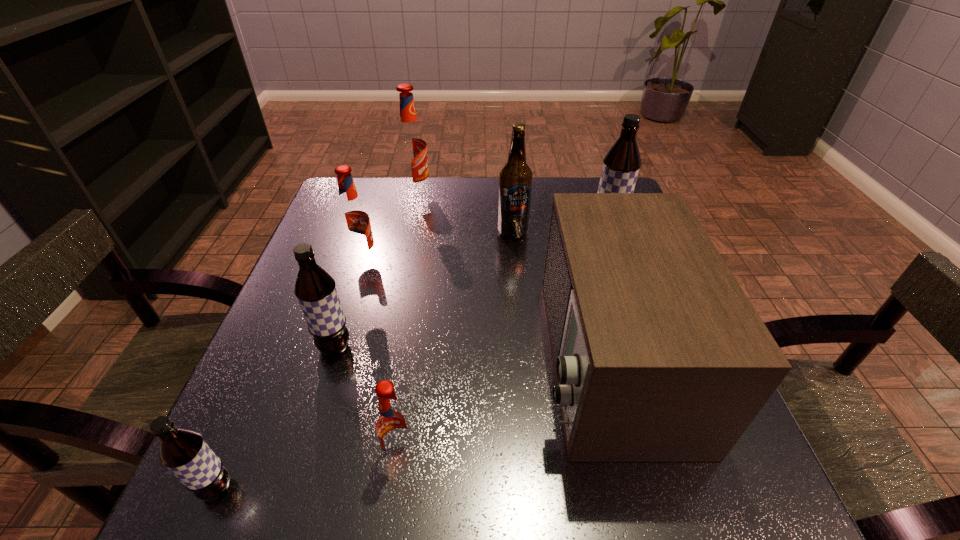
You are a GUI agent. You are given a task and a screenshot of the screen. Output one action in this format:
    pyautogui.click(x=<x>, y=<y>)
    Task: Click on the farthest red root beer
    Image resolution: width=960 pixels, height=540 pixels.
    Given the screenshot: What is the action you would take?
    pyautogui.click(x=411, y=148)

The width and height of the screenshot is (960, 540). Identify the location of the farthest object. (411, 148).

The width and height of the screenshot is (960, 540). Identify the location of the fifth nearest root beer. (621, 165).

This screenshot has width=960, height=540. Identify the location of the rightmost brown root beer. (621, 165).

You are a GUI agent. You are given a task and a screenshot of the screen. Output one action in this format:
    pyautogui.click(x=<x>, y=<y>)
    Task: Click on the beer bottle
    Image resolution: width=960 pixels, height=540 pixels.
    Given the screenshot: What is the action you would take?
    pyautogui.click(x=515, y=180)

At what (x,y) coordinates should I click in order to perform the action: click on the second nearest red root beer. Please return your answer as a coordinate pair (x, y). This screenshot has height=540, width=960. Looking at the image, I should click on (353, 218).

Identify the location of the fourth nearest root beer. The image size is (960, 540). (353, 218).

Image resolution: width=960 pixels, height=540 pixels. Identify the location of the third nearest root beer. (315, 289).

Where is `the second nearest brown root beer`? The height and width of the screenshot is (540, 960). the second nearest brown root beer is located at coordinates click(x=315, y=289).

Image resolution: width=960 pixels, height=540 pixels. I want to click on radio receiver, so click(659, 356).